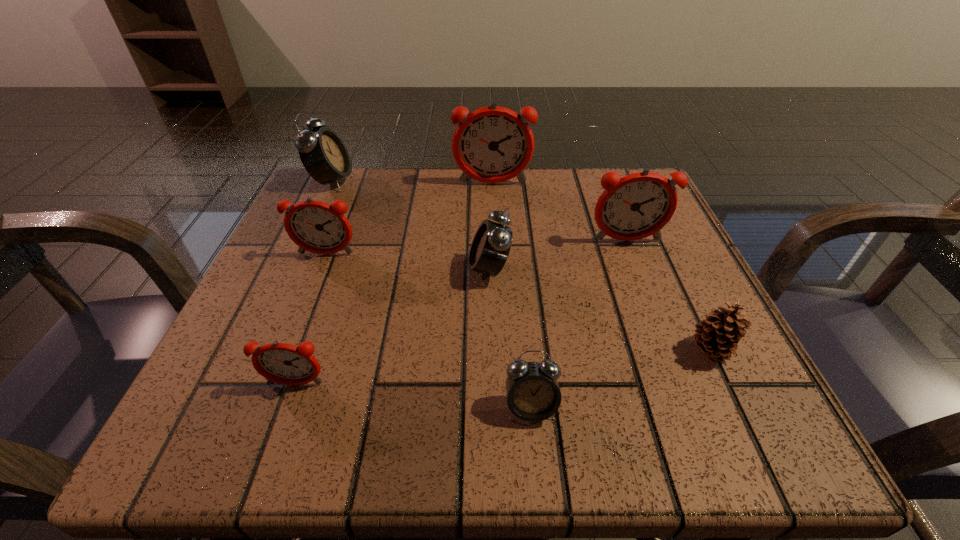
Where is `the tallest object`? This screenshot has height=540, width=960. the tallest object is located at coordinates (493, 144).

Identify the location of the biggest reddish-pink alarm clock. (493, 144).

Where is `the farthest white alarm clock`? The image size is (960, 540). the farthest white alarm clock is located at coordinates (323, 154).

This screenshot has height=540, width=960. Find the location of `the leftmost white alarm clock`. the leftmost white alarm clock is located at coordinates (323, 154).

Where is `the third farthest alarm clock`? The height and width of the screenshot is (540, 960). the third farthest alarm clock is located at coordinates (639, 205).

In order to click on the second farthest reddish-pink alarm clock in this screenshot , I will do `click(639, 205)`.

The image size is (960, 540). I want to click on the second nearest white alarm clock, so click(490, 248).

Identify the location of the third biggest reddish-pink alarm clock. (317, 227).

Where is `pinecone`? Image resolution: width=960 pixels, height=540 pixels. pinecone is located at coordinates (717, 336).

Locate an element on the screen. the nearest reddish-pink alarm clock is located at coordinates (286, 364).